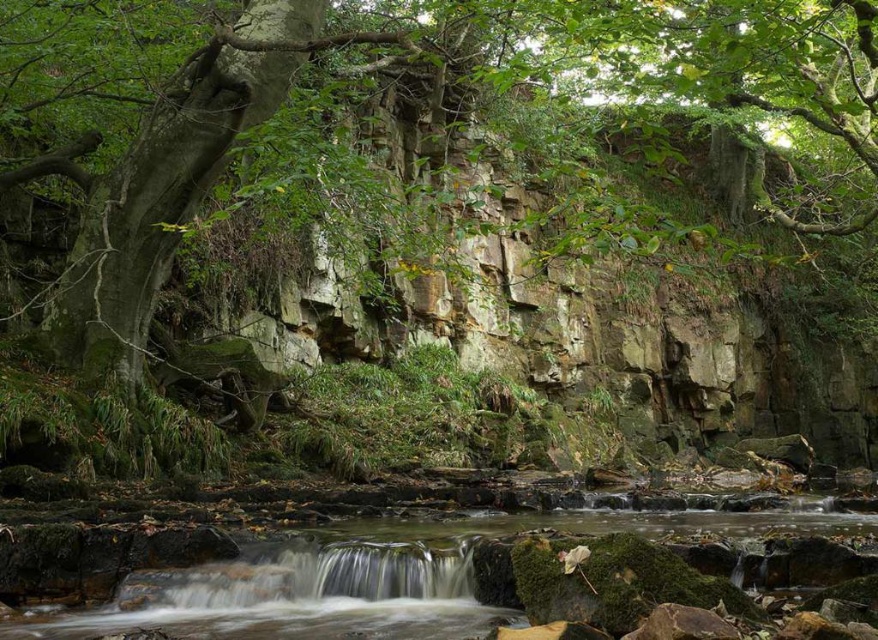
You are a hiker who wants to cross the stream. You see the green rough bark tree at center and the green mossy rocks at center. Which object is closer to you as you stand on the bank preparing to cross?

The green rough bark tree at center is closer to you since the green mossy rocks at center are positioned behind it.

You are standing at the edge of the stream and want to reach the green rough bark tree at center. Which direction should you head towards from your current position?

The green rough bark tree at center is located at point (458,195), so you should head towards the center of the scene from the stream edge to reach it.

You are a hiker who wants to cross the stream between the green rough bark tree at center and the green mossy rocks at center. The stream is 1.5 meters wide. Can you safely cross the stream if you are 1.8 meters tall?

The distance between the green rough bark tree at center and the green mossy rocks at center is 13.49 meters. Since the stream is only 1.5 meters wide, you can safely cross it as the width is less than your height of 1.8 meters.